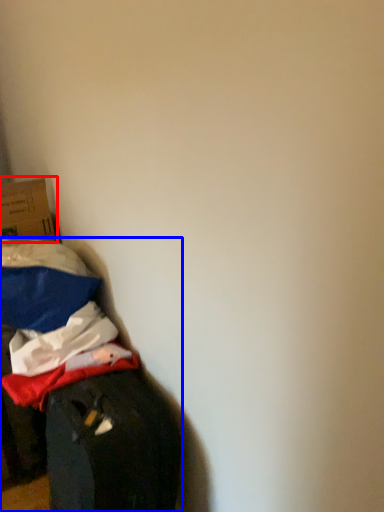
Question: Which of the following is the closest to the observer, box (highlighted by a red box) or furniture (highlighted by a blue box)?

Choices:
 (A) box
 (B) furniture

Answer: (B)